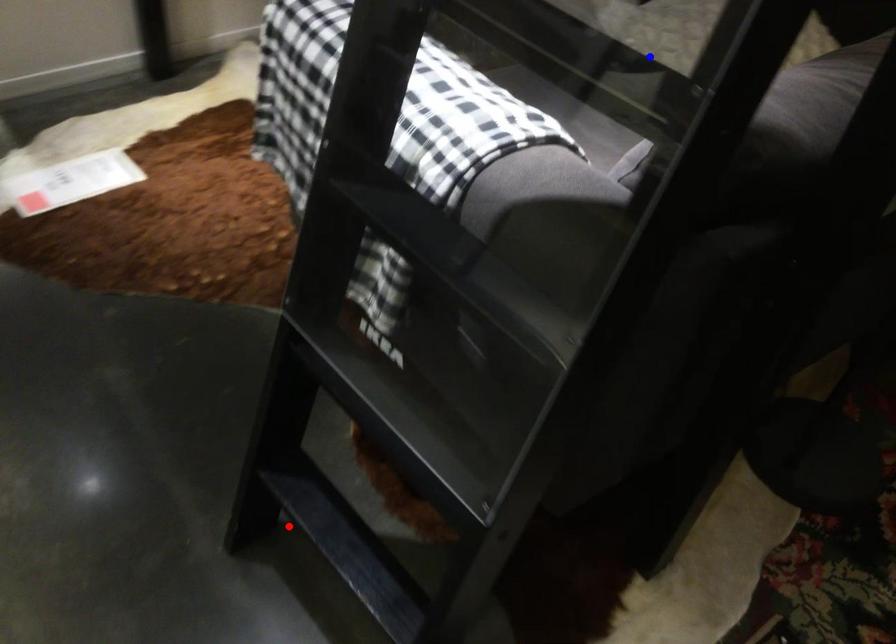
Question: Which of the two points in the image is closer to the camera?

Choices:
 (A) Blue point is closer.
 (B) Red point is closer.

Answer: (A)